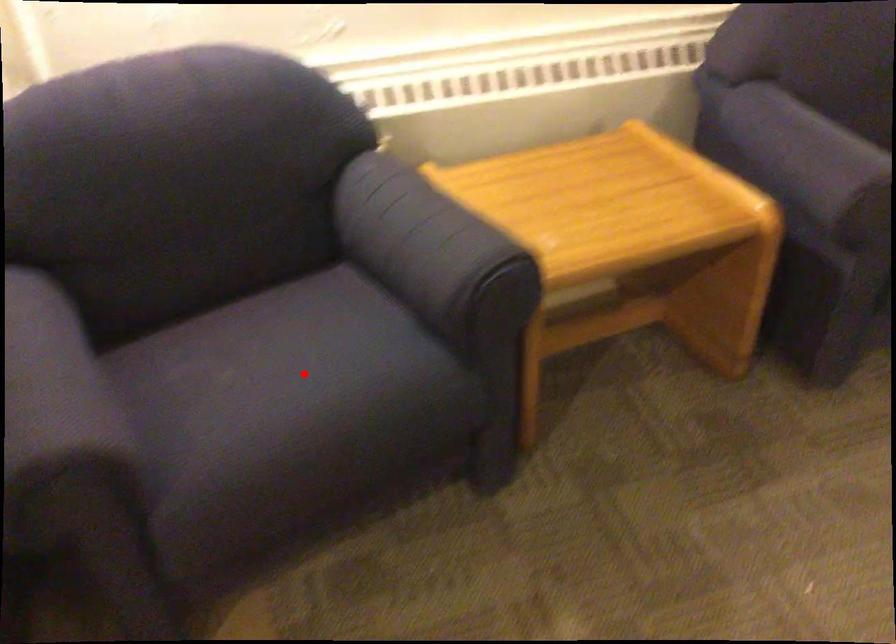
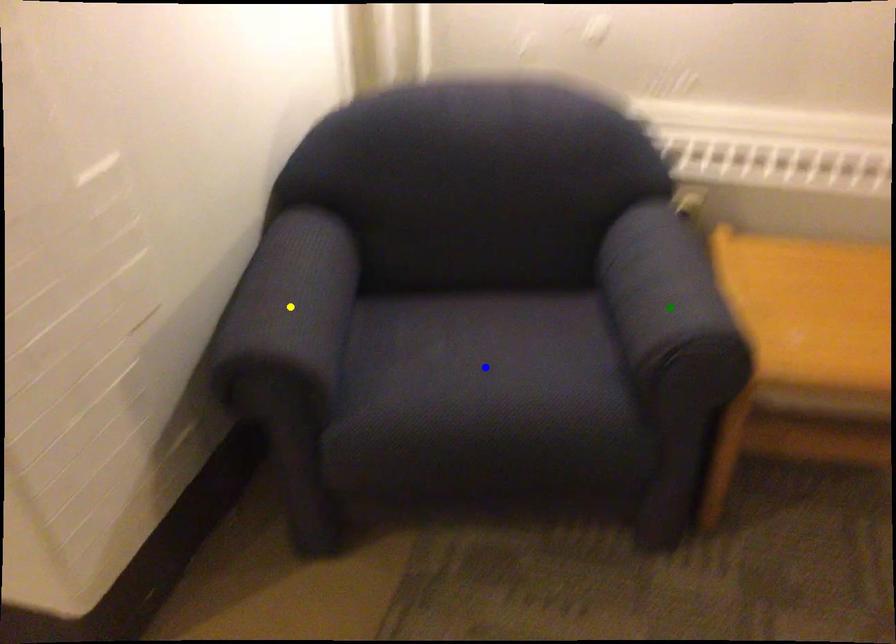
Question: I am providing you with two images of the same scene from different viewpoints. A red point is marked on the first image. You are given multiple points on the second image. Which point in image 2 is actually the same real-world point as the red point in image 1?

Choices:
 (A) blue point
 (B) yellow point
 (C) green point

Answer: (A)